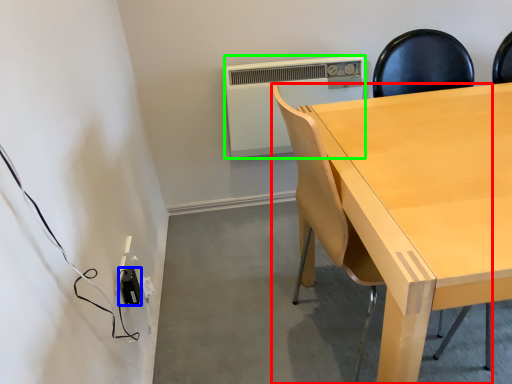
Question: Considering the real-world distances, which object is farthest from chair (highlighted by a red box)? electric outlet (highlighted by a blue box) or air conditioning (highlighted by a green box)?

Choices:
 (A) electric outlet
 (B) air conditioning

Answer: (B)